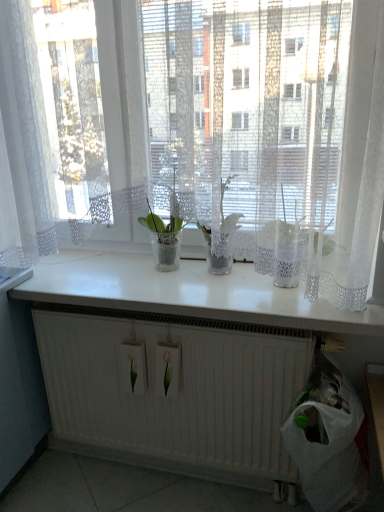
At what (x,y) coordinates should I click in order to perform the action: click on vacant region to the left of translucent glass vase at center. Please return your answer as a coordinate pair (x, y). This screenshot has height=512, width=384. Looking at the image, I should click on (166, 285).